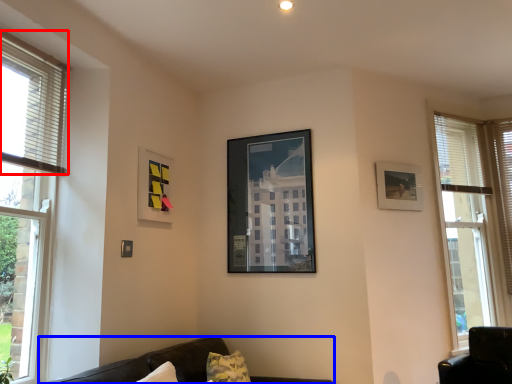
Question: Among these objects, which one is farthest to the camera, blind (highlighted by a red box) or studio couch (highlighted by a blue box)?

Choices:
 (A) blind
 (B) studio couch

Answer: (A)